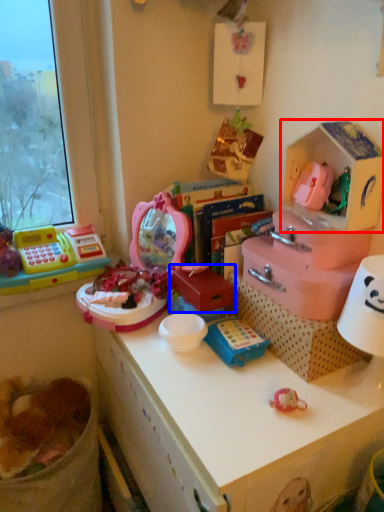
Question: Which object is further to the camera taking this photo, storage box (highlighted by a red box) or box (highlighted by a blue box)?

Choices:
 (A) storage box
 (B) box

Answer: (B)